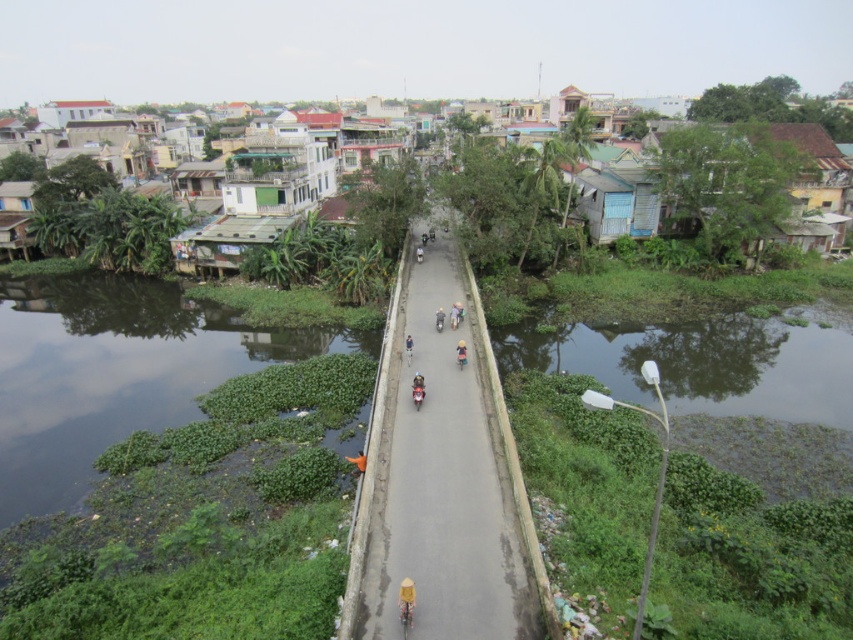
You are standing on the narrow concrete bridge over the water. You see a point marked at coordinates (114, 372). What is the object located at that point?

The point at coordinates (114, 372) corresponds to green algae at lower left.

You are a pedestrian standing on the bridge and looking down. You see the green algae at lower left and the blue fabric jacket at center. Which object is closer to the edge of the bridge?

The green algae at lower left is closer to the edge of the bridge because it is located above the blue fabric jacket at center, which places it nearer to the bridge edge compared to the jacket.